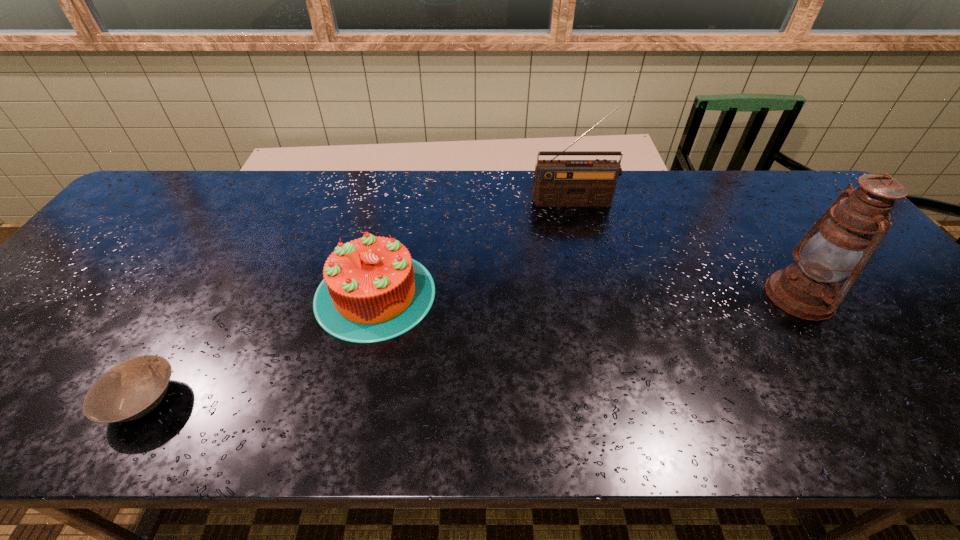
Locate an element on the screen. vacant space located on the back of the shortest object is located at coordinates (204, 296).

You are a GUI agent. You are given a task and a screenshot of the screen. Output one action in this format:
    pyautogui.click(x=<x>, y=<y>)
    Task: Click on the object present at the far edge
    
    Given the screenshot: What is the action you would take?
    pyautogui.click(x=556, y=182)

Find the location of a particular element. This screenshot has width=960, height=540. object positioned at the near edge is located at coordinates (130, 390).

In the image, there is a desktop. Identify the location of vacant space at the far edge. (341, 186).

Where is `vacant space at the near edge of the desktop`? This screenshot has height=540, width=960. vacant space at the near edge of the desktop is located at coordinates (935, 437).

The width and height of the screenshot is (960, 540). I want to click on free location at the left edge of the desktop, so click(x=68, y=332).

Identify the location of free point between the bowl and the oil lamp. Image resolution: width=960 pixels, height=540 pixels. (471, 348).

Find the location of a particular element. The image size is (960, 540). unoccupied position between the bowl and the second object from left to right is located at coordinates (259, 347).

Locate an element on the screen. The height and width of the screenshot is (540, 960). free space that is in between the oil lamp and the third object from right to left is located at coordinates (588, 295).

This screenshot has width=960, height=540. In order to click on blank region between the oil lamp and the shortest object in this screenshot , I will do `click(471, 348)`.